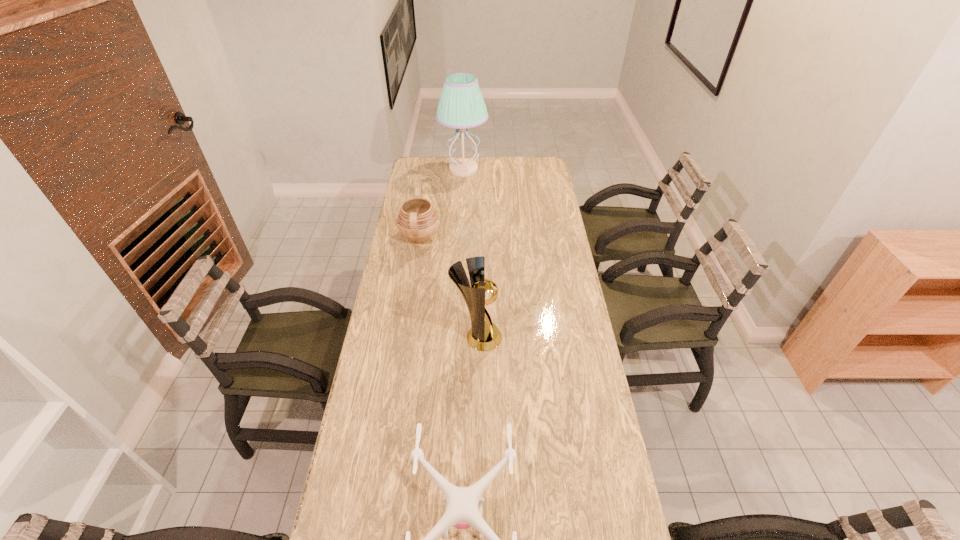
This screenshot has width=960, height=540. Identify the location of lamp positioned at the left edge. (461, 105).

Image resolution: width=960 pixels, height=540 pixels. Identify the location of urn present at the left edge. (418, 221).

You are a GUI agent. You are given a task and a screenshot of the screen. Output one action in this format:
    pyautogui.click(x=<x>, y=<y>)
    Task: Click on the object that is at the far left corner
    
    Given the screenshot: What is the action you would take?
    pyautogui.click(x=461, y=105)

In the image, there is a desktop. Identify the location of blank space at the far edge. The height and width of the screenshot is (540, 960). click(x=444, y=169).

In the image, there is a desktop. At what (x,y) coordinates should I click in order to perform the action: click on vacant space at the right edge. Please return your answer as a coordinate pair (x, y). The image size is (960, 540). Looking at the image, I should click on (541, 256).

Locate an element on the screen. vacant space at the far left corner of the desktop is located at coordinates (429, 161).

Locate an element on the screen. The image size is (960, 540). vacant area at the far right corner of the desktop is located at coordinates pos(547,171).

The height and width of the screenshot is (540, 960). I want to click on vacant point located between the second farthest object and the third shortest object, so click(x=448, y=288).

Where is `object that ranks as the closest to the second nearest object`? The height and width of the screenshot is (540, 960). object that ranks as the closest to the second nearest object is located at coordinates (461, 512).

Select which object appears as the closest to the shortest object. Please provide its 2D coordinates. Your answer should be formatted as a tuple, i.e. [(x, y)], where the tuple contains the x and y coordinates of a point satisfying the conditions above.

[(484, 335)]